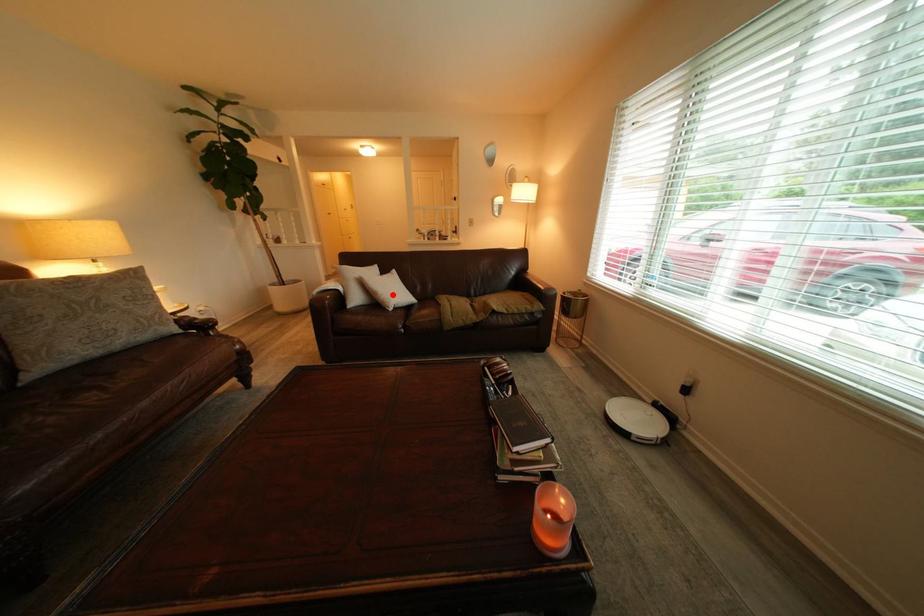
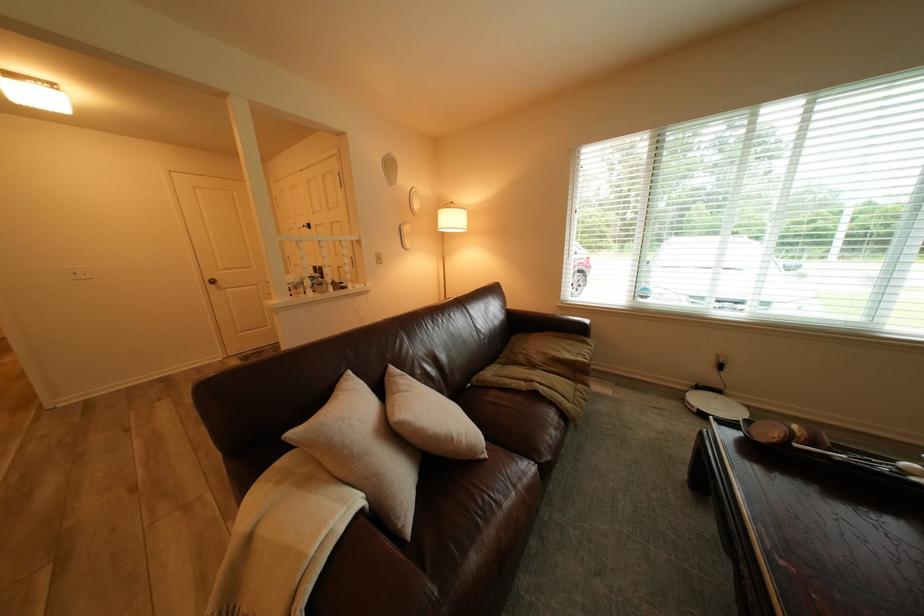
Question: I am providing you with two images of the same scene from different viewpoints. Image1 has a red point marked. In image2, the corresponding 3D location appears at what relative position? Reply with the corresponding letter.

Choices:
 (A) Closer
 (B) Farther

Answer: (A)